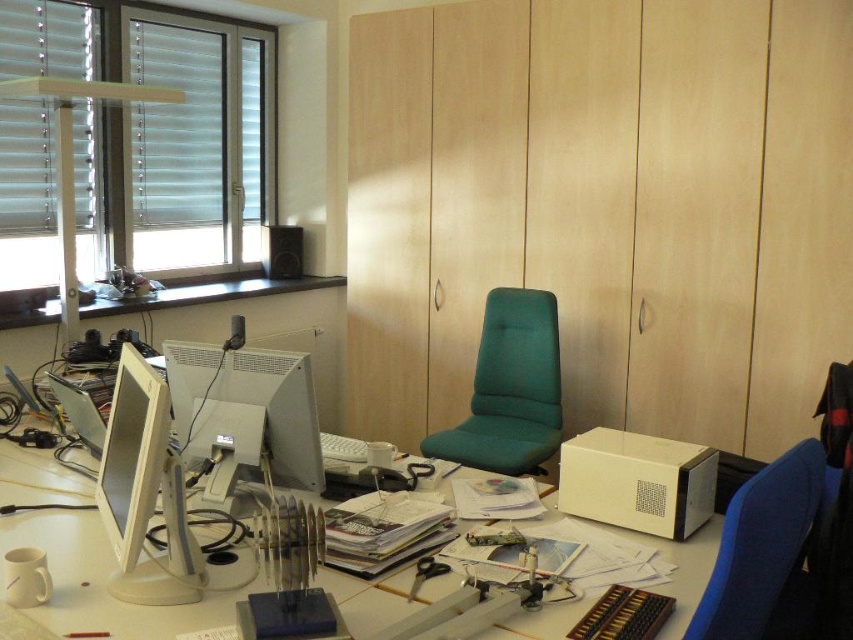
You are standing at the desk in the office scene. There are two points marked on the desk surface. One is at coordinate point (200, 144) and the other at point (207, 412). If you want to move an object from the point closer to you to the one further away, which coordinate should you move it to?

You should move the object to point (207, 412) because point (200, 144) is behind point (207, 412), meaning it is closer to you. The further point is (207, 412).

You are organizing the desk and need to place a 12 inch ruler between the white plastic table at center and the matte white monitor at left. Will the ruler fit between them?

The distance between the white plastic table at center and the matte white monitor at left is 11.44 inches, so the 12 inch ruler will not fit between them as it is slightly longer than the available space.

You are standing at the entrance of the office and see the point marked at coordinates (97,582). What object is located at those coordinates?

The point marked at coordinates (97,582) is located at the white plastic table at center.